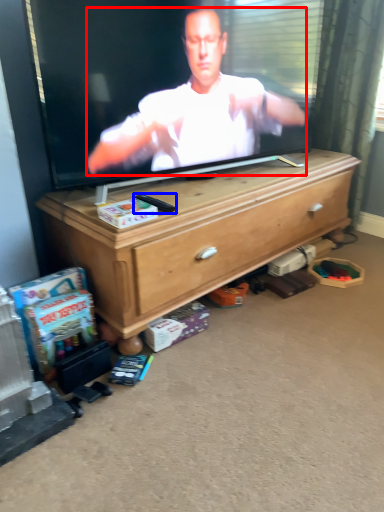
Question: Which object is further to the camera taking this photo, person (highlighted by a red box) or remote control (highlighted by a blue box)?

Choices:
 (A) person
 (B) remote control

Answer: (B)